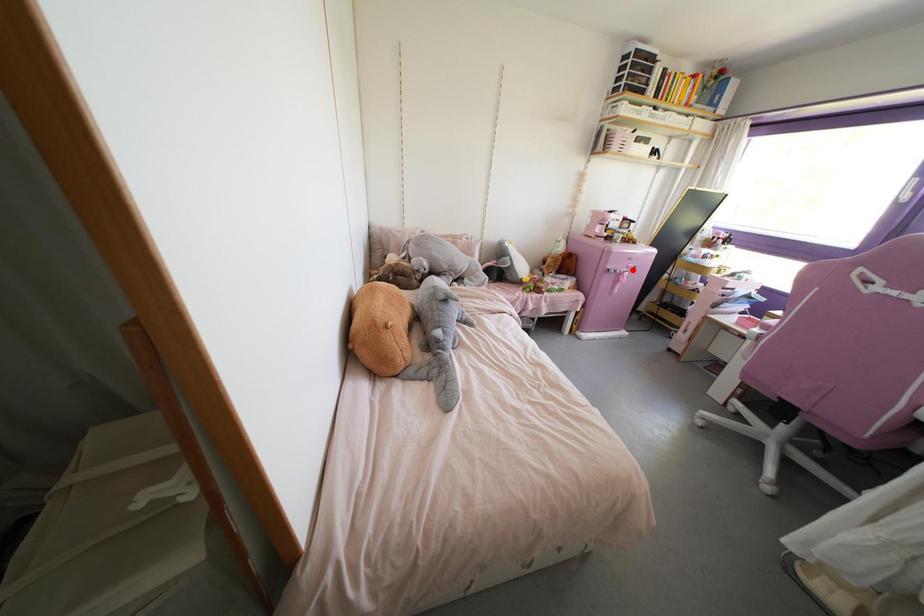
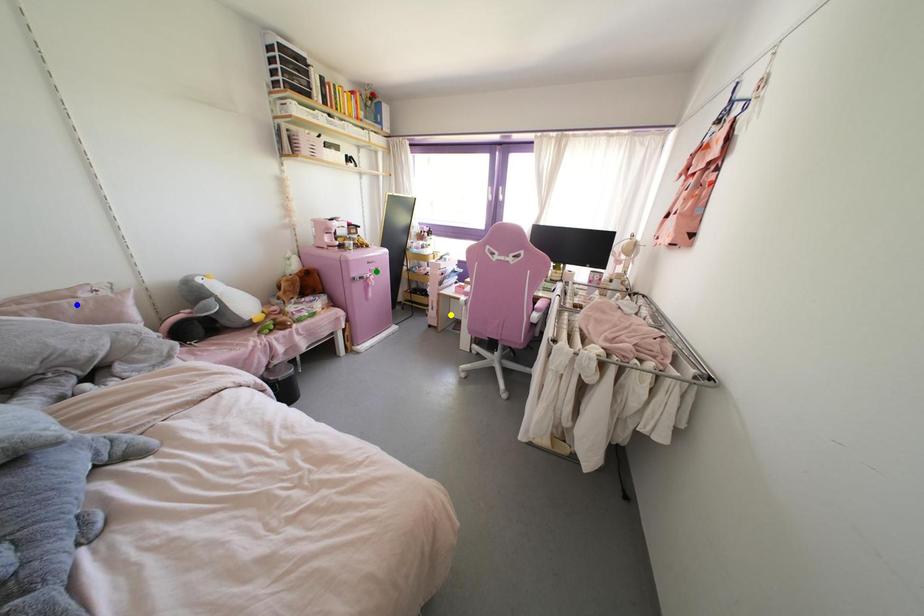
Question: I am providing you with two images of the same scene from different viewpoints. A red point is marked on the first image. You are given multiple points on the second image. Which point in image 2 is actually the same real-world point as the red point in image 1?

Choices:
 (A) blue point
 (B) green point
 (C) yellow point

Answer: (B)